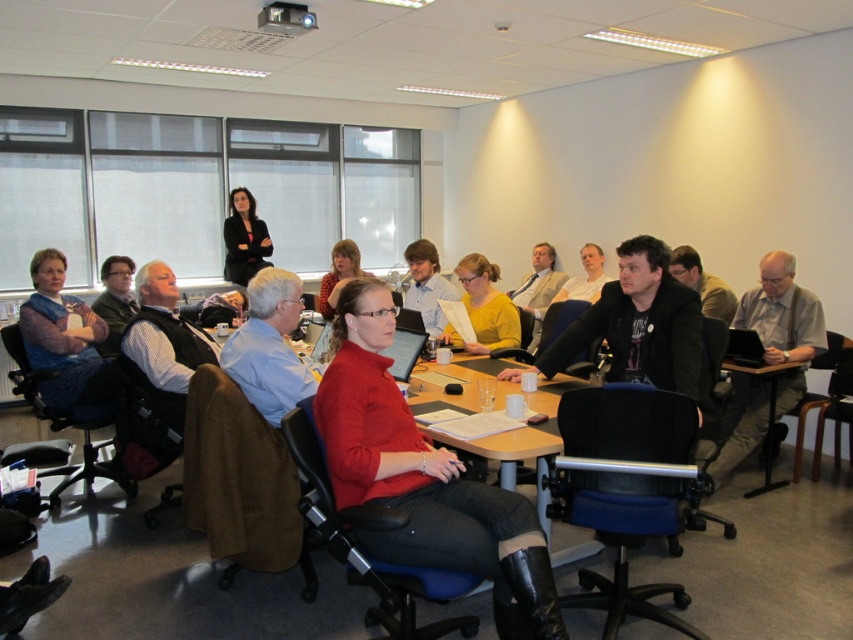
Who is higher up, blue shirt at center or light brown leather jacket at center?

light brown leather jacket at center

Based on the photo, between blue shirt at center and light brown leather jacket at center, which one appears on the right side from the viewer's perspective?

light brown leather jacket at center

Does point (281, 348) come farther from viewer compared to point (535, 317)?

No, (281, 348) is closer to viewer.

You are a GUI agent. You are given a task and a screenshot of the screen. Output one action in this format:
    pyautogui.click(x=<x>, y=<y>)
    Task: Click on the blue shirt at center
    
    Given the screenshot: What is the action you would take?
    pyautogui.click(x=270, y=346)

Which is more to the left, knitted sweater at left or blue shirt at center?

knitted sweater at left is more to the left.

Can you confirm if knitted sweater at left is taller than blue shirt at center?

Yes.

What do you see at coordinates (64, 339) in the screenshot? Image resolution: width=853 pixels, height=640 pixels. I see `knitted sweater at left` at bounding box center [64, 339].

Locate an element on the screen. Image resolution: width=853 pixels, height=640 pixels. knitted sweater at left is located at coordinates (64, 339).

Who is positioned more to the right, light gray fabric shirt at center or matte black blazer at upper center?

Positioned to the right is light gray fabric shirt at center.

Consider the image. Who is more distant from viewer, (799, 381) or (236, 230)?

The point (236, 230) is more distant.

Identify the location of light gray fabric shirt at center. Image resolution: width=853 pixels, height=640 pixels. (769, 358).